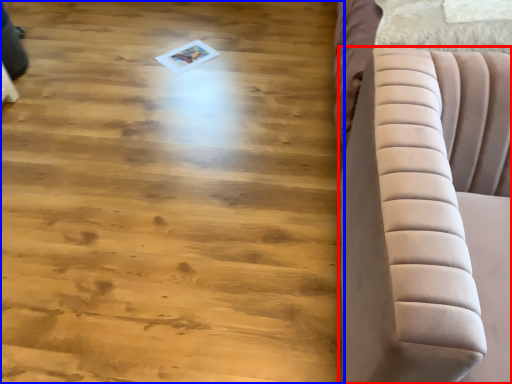
Question: Which of the following is the farthest to the observer, furniture (highlighted by a red box) or hardwood (highlighted by a blue box)?

Choices:
 (A) furniture
 (B) hardwood

Answer: (B)